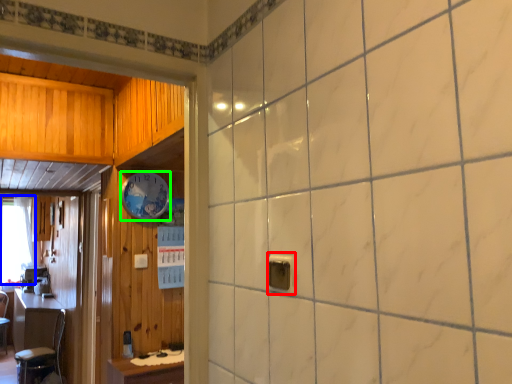
Question: Which is nearer to the electric outlet (highlighted by a red box)? window (highlighted by a blue box) or clock (highlighted by a green box).

Choices:
 (A) window
 (B) clock

Answer: (B)